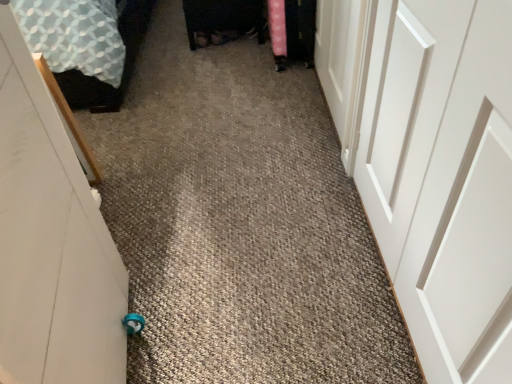
This screenshot has width=512, height=384. What are the coordinates of `vacant space in white matte door at left, placed as the first door when sorted from left to right (from a real-world perspective)` in the screenshot? It's located at click(138, 341).